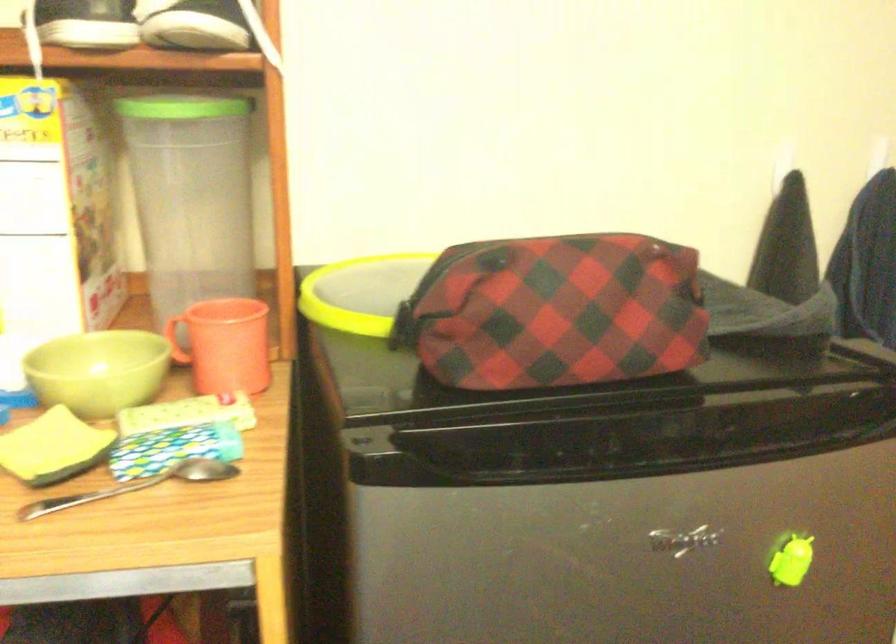
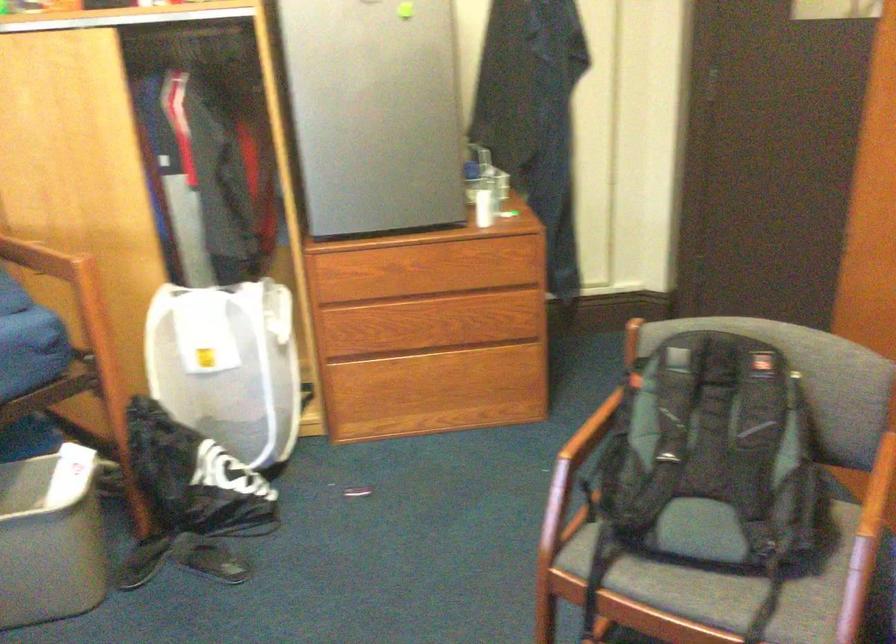
What movement of the cameraman would produce the second image?

The cameraman walked toward right, backward.